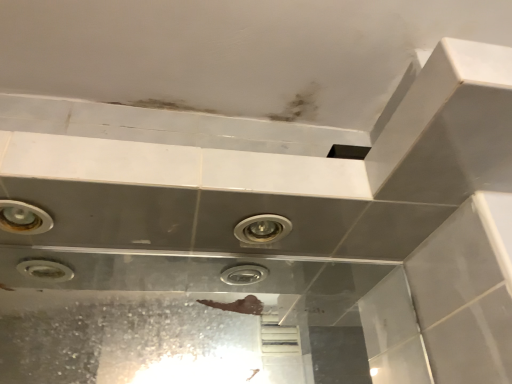
Describe the element at coordinates (23, 218) in the screenshot. I see `matte silver light fixture at upper left` at that location.

Find the location of a particular element. The image size is (512, 384). matte silver light fixture at upper left is located at coordinates (23, 218).

The height and width of the screenshot is (384, 512). What do you see at coordinates (262, 229) in the screenshot?
I see `matte silver light fixture at center` at bounding box center [262, 229].

The image size is (512, 384). What are the coordinates of `matte silver light fixture at center` in the screenshot? It's located at (262, 229).

What is the approximate width of matte silver light fixture at center?

The width of matte silver light fixture at center is 3.84 inches.

What is the approximate height of matte silver light fixture at center?

It is 1.28 centimeters.

Identify the location of matte silver light fixture at upper left. This screenshot has width=512, height=384. (23, 218).

Does matte silver light fixture at upper left appear on the left side of matte silver light fixture at center?

Yes.

Is the depth of matte silver light fixture at upper left greater than that of matte silver light fixture at center?

No, matte silver light fixture at upper left is closer to the viewer.

Is point (17, 230) farther from camera compared to point (243, 234)?

That is False.

From the image's perspective, is matte silver light fixture at upper left above or below matte silver light fixture at center?

matte silver light fixture at upper left is situated higher than matte silver light fixture at center in the image.

From a real-world perspective, does matte silver light fixture at upper left stand above matte silver light fixture at center?

No, from a real-world perspective, matte silver light fixture at upper left is not on top of matte silver light fixture at center.

Considering the sizes of objects matte silver light fixture at upper left and matte silver light fixture at center in the image provided, who is wider, matte silver light fixture at upper left or matte silver light fixture at center?

Wider between the two is matte silver light fixture at upper left.

In terms of height, does matte silver light fixture at upper left look taller or shorter compared to matte silver light fixture at center?

Clearly, matte silver light fixture at upper left is shorter compared to matte silver light fixture at center.

Is matte silver light fixture at upper left smaller than matte silver light fixture at center?

Indeed, matte silver light fixture at upper left has a smaller size compared to matte silver light fixture at center.

Is matte silver light fixture at center a part of matte silver light fixture at upper left?

No, matte silver light fixture at center is not inside matte silver light fixture at upper left.

Is matte silver light fixture at upper left far from matte silver light fixture at center?

Actually, matte silver light fixture at upper left and matte silver light fixture at center are a little close together.

Does matte silver light fixture at upper left turn towards matte silver light fixture at center?

No, matte silver light fixture at upper left does not turn towards matte silver light fixture at center.

Could you measure the distance between matte silver light fixture at upper left and matte silver light fixture at center?

matte silver light fixture at upper left and matte silver light fixture at center are 12.48 inches apart.

The height and width of the screenshot is (384, 512). Identify the location of bubble in front of the matte silver light fixture at center. (23, 218).

Is matte silver light fixture at center at the left side of matte silver light fixture at upper left?

No.

Considering the positions of objects matte silver light fixture at center and matte silver light fixture at upper left in the image provided, who is behind, matte silver light fixture at center or matte silver light fixture at upper left?

matte silver light fixture at center is further away from the camera.

Which point is more distant from viewer, (259, 222) or (29, 217)?

Point (259, 222)

From the image's perspective, relative to matte silver light fixture at upper left, is matte silver light fixture at center above or below?

matte silver light fixture at center is situated lower than matte silver light fixture at upper left in the image.

From a real-world perspective, is matte silver light fixture at center on matte silver light fixture at upper left?

Yes, from a real-world perspective, matte silver light fixture at center is over matte silver light fixture at upper left

Looking at their sizes, would you say matte silver light fixture at center is wider or thinner than matte silver light fixture at upper left?

matte silver light fixture at center is thinner than matte silver light fixture at upper left.

Considering the sizes of objects matte silver light fixture at center and matte silver light fixture at upper left in the image provided, who is shorter, matte silver light fixture at center or matte silver light fixture at upper left?

matte silver light fixture at upper left.

Is matte silver light fixture at center smaller than matte silver light fixture at upper left?

No.

Which is correct: matte silver light fixture at center is inside matte silver light fixture at upper left, or outside of it?

The correct answer is: outside.

Is the surface of matte silver light fixture at center in direct contact with matte silver light fixture at upper left?

No, matte silver light fixture at center is not touching matte silver light fixture at upper left.

Is matte silver light fixture at center turned away from matte silver light fixture at upper left?

No, matte silver light fixture at center's orientation is not away from matte silver light fixture at upper left.

Could you measure the distance between matte silver light fixture at center and matte silver light fixture at upper left?

matte silver light fixture at center is 12.48 inches away from matte silver light fixture at upper left.

Image resolution: width=512 pixels, height=384 pixels. I want to click on bubble in front of the matte silver light fixture at center, so [23, 218].

The width and height of the screenshot is (512, 384). What are the coordinates of `bubble below the matte silver light fixture at center (from a real-world perspective)` in the screenshot? It's located at (23, 218).

Locate an element on the screen. This screenshot has height=384, width=512. bubble on the left side of matte silver light fixture at center is located at coordinates (23, 218).